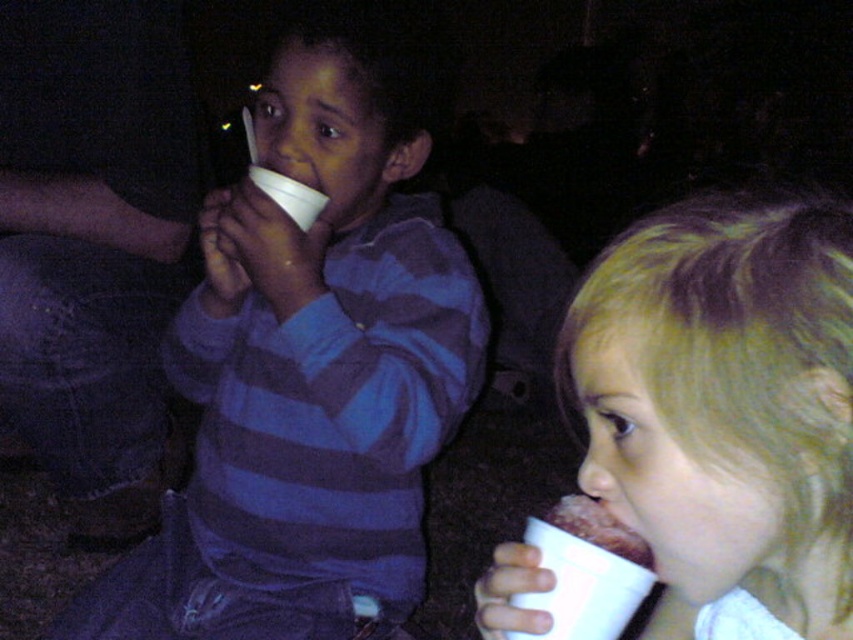
You are a photographer trying to capture both children in focus. You notice two points of light in the scene at coordinates point (410, 486) and point (567, 499). Which point should you focus on first to ensure the closer object is sharp?

Point (410, 486) is closer to the viewer than point (567, 499). Therefore, you should focus on point (410, 486) first to ensure the closer object is sharp.

You are a photographer at the scene and want to take a closeup of the matte paper cup at center. Based on its position, where should you aim your camera?

The matte paper cup at center is located at point 0.586 on the x axis and 0.362 on the y axis, so you should aim your camera at those coordinates to capture it.

You are a photographer at an outdoor evening event. You need to capture a photo of both the matte paper cup at center and the chocolate cake at lower right. However, you can only focus on one object at a time. Which object should you focus on first to ensure it appears sharp in the photo?

You should focus on the matte paper cup at center first because it is closer to the viewer than the chocolate cake at lower right, so focusing on it will keep it sharp while the cake may appear slightly blurred. Alternatively, if you focus on the cake, the cup might be out of focus.